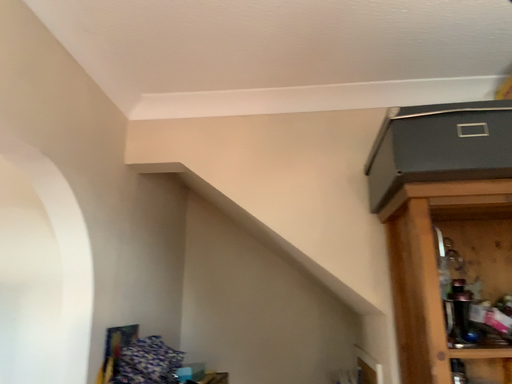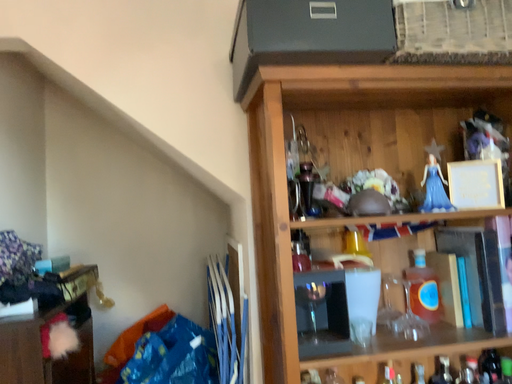
Question: Which way did the camera rotate in the video?

Choices:
 (A) rotated left
 (B) rotated right

Answer: (B)